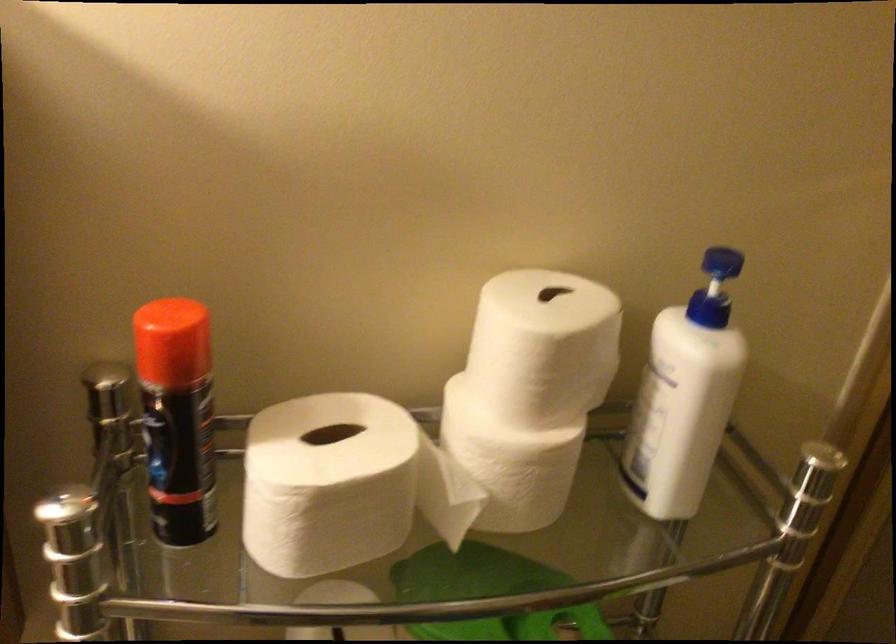
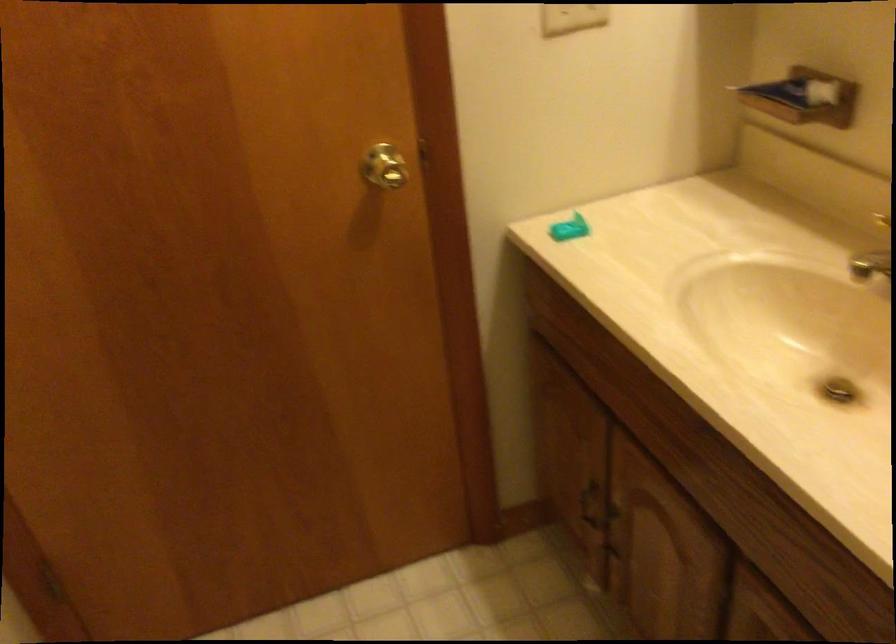
How did the camera likely rotate?

The camera rotated toward left-down.